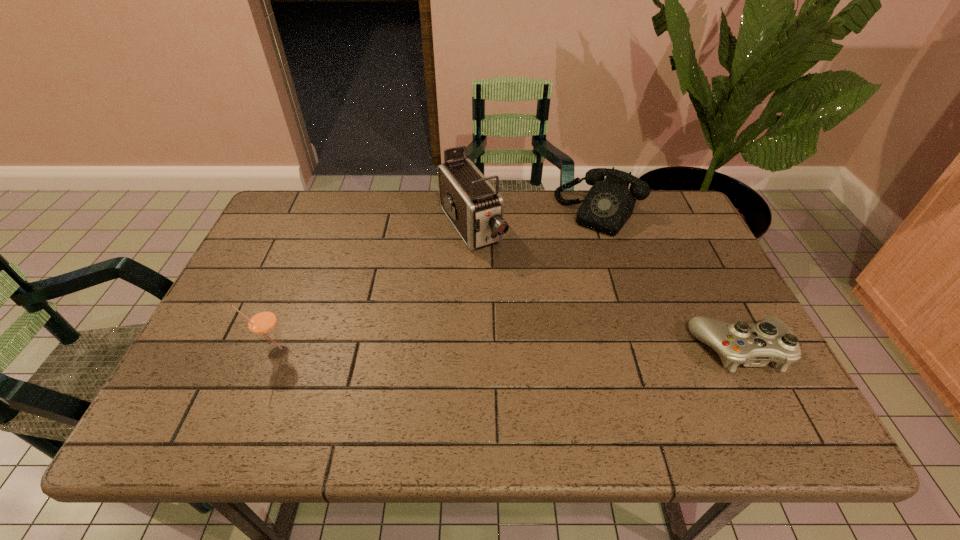
Identify the location of free space between the telephone and the second tallest object. This screenshot has width=960, height=540. (439, 282).

This screenshot has width=960, height=540. Find the location of `vacant space that's between the tallest object and the second shortest object`. vacant space that's between the tallest object and the second shortest object is located at coordinates (536, 220).

Where is `empty space that is in between the telephone and the tallest object`? The image size is (960, 540). empty space that is in between the telephone and the tallest object is located at coordinates (536, 220).

Locate an element on the screen. The image size is (960, 540). vacant space in between the leftmost object and the telephone is located at coordinates (439, 282).

The width and height of the screenshot is (960, 540). What are the coordinates of `empty space that is in between the telephone and the camcorder` in the screenshot? It's located at (536, 220).

In order to click on blank region between the telephone and the second tallest object in this screenshot , I will do `click(439, 282)`.

Identify the location of vacant area that lies between the second object from left to right and the control. (606, 288).

Locate an element on the screen. This screenshot has height=540, width=960. vacant space that's between the tallest object and the leftmost object is located at coordinates (374, 289).

Identify the location of unoccupied position between the telephone and the third object from right to left. (536, 220).

I want to click on vacant space that is in between the second shortest object and the straw, so click(439, 282).